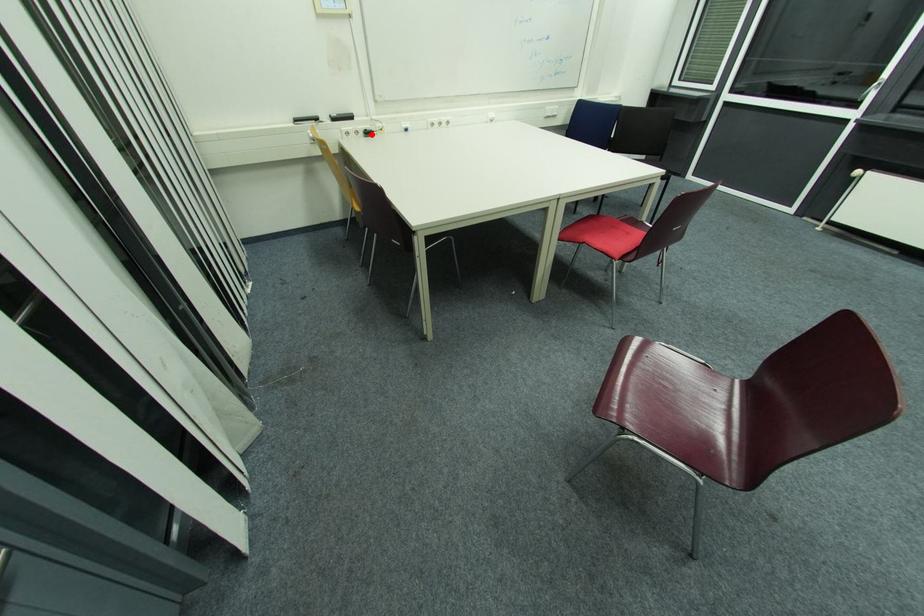
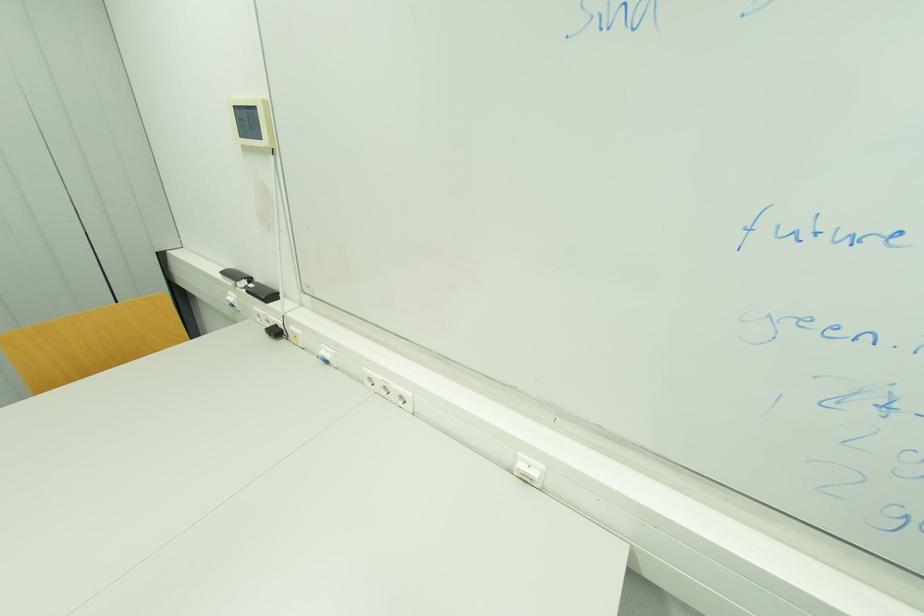
Find the pixel in the second image that matches the highlighted location in the first image.

(281, 333)